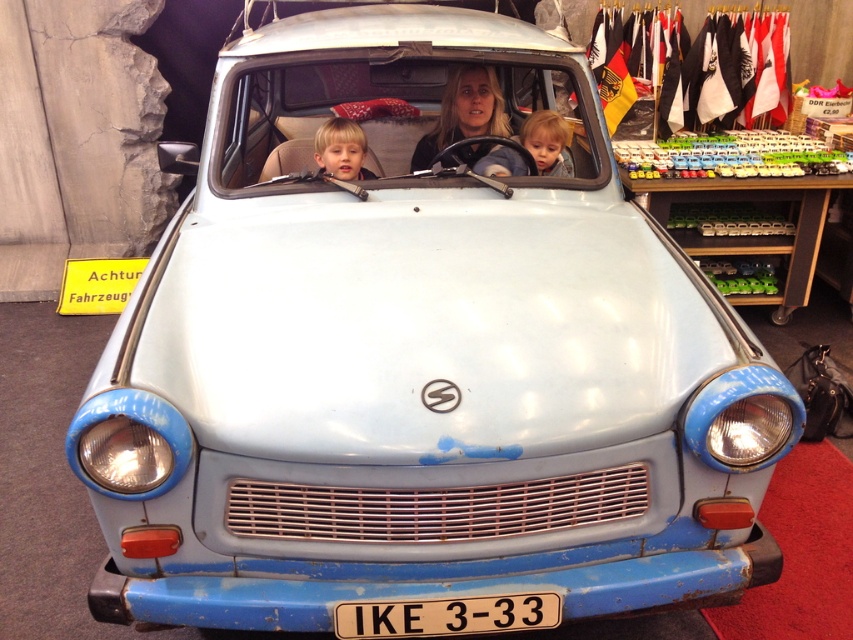
You are a passenger in the vintage Trabant car. You notice the white plastic license plate at center and the smooth skin child at center. Which object is closer to you?

The white plastic license plate at center is closer to you because it is positioned in front of the smooth skin child at center.

You are a photographer taking a picture of the vintage Trabant car. You notice the white plastic license plate at center and the smooth skin child at center. Which object is closer to the camera?

The smooth skin child at center is closer to the camera than the white plastic license plate at center because the license plate is positioned under the child.

You are a photographer taking a portrait of the matte black hair at center and the smooth skin child at center in the car. Which object is positioned higher in the frame?

The matte black hair at center is above the smooth skin child at center, so it is positioned higher in the frame.